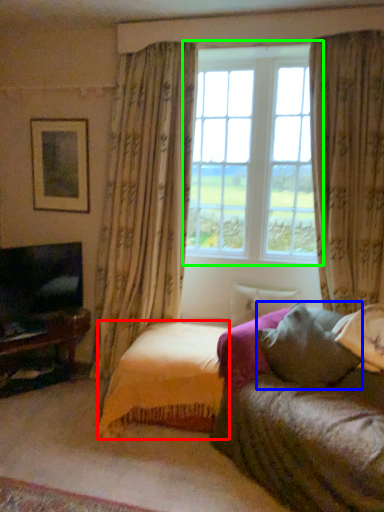
Question: Estimate the real-world distances between objects in this image. Which object is closer to bedding (highlighted by a red box), pillow (highlighted by a blue box) or window (highlighted by a green box)?

Choices:
 (A) pillow
 (B) window

Answer: (A)